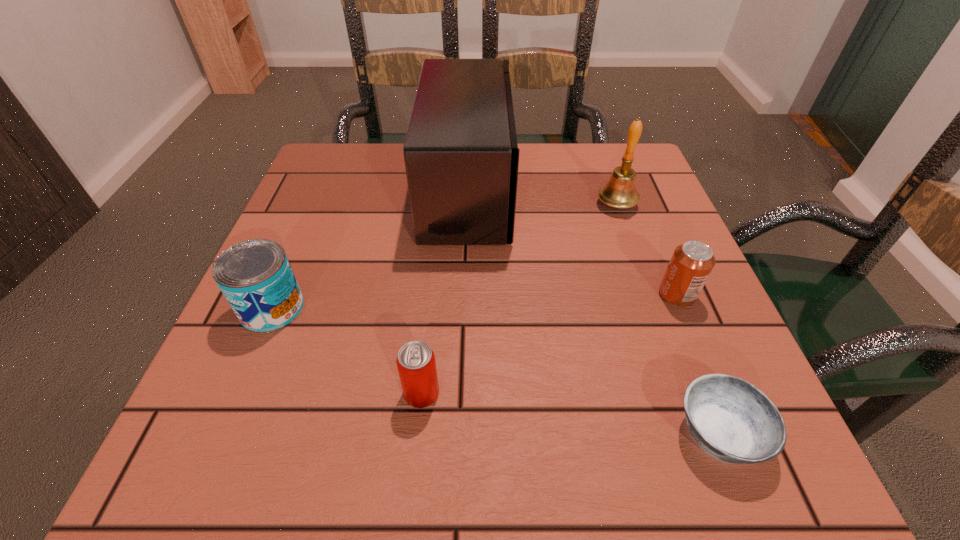
At what (x,y) coordinates should I click in order to perform the action: click on object located in the near right corner section of the desktop. Please return your answer as a coordinate pair (x, y). Looking at the image, I should click on (733, 421).

This screenshot has width=960, height=540. Find the location of `vacant space at the far edge`. vacant space at the far edge is located at coordinates pos(530,147).

You are a GUI agent. You are given a task and a screenshot of the screen. Output one action in this format:
    pyautogui.click(x=<x>, y=<y>)
    Task: Click on the vacant space at the near edge of the desktop
    
    Given the screenshot: What is the action you would take?
    pyautogui.click(x=374, y=451)

Where is `free region at the left edge of the desktop`? Image resolution: width=960 pixels, height=540 pixels. free region at the left edge of the desktop is located at coordinates (335, 246).

In the image, there is a desktop. Find the location of `free region at the right edge`. free region at the right edge is located at coordinates (594, 206).

Image resolution: width=960 pixels, height=540 pixels. Find the location of `free space at the far left corner of the desktop`. free space at the far left corner of the desktop is located at coordinates (373, 155).

The height and width of the screenshot is (540, 960). Identify the location of free point at the far right corner. (608, 146).

What are the coordinates of `free point between the ashtray and the second can from left to right` in the screenshot? It's located at (570, 413).

Locate an element on the screen. Image resolution: width=960 pixels, height=540 pixels. vacant space that is in between the rightmost can and the nearest can is located at coordinates (549, 344).

Where is `vacant area that lies between the nearest can and the rightmost can`? The width and height of the screenshot is (960, 540). vacant area that lies between the nearest can and the rightmost can is located at coordinates (549, 344).